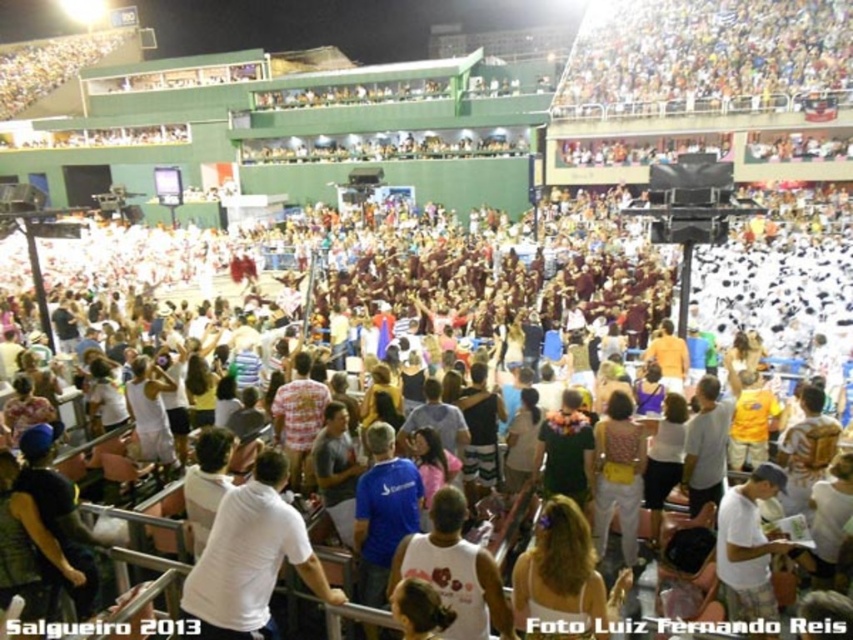
Question: In this image, where is white matte shirt at center located relative to white cotton shirt at center?

Choices:
 (A) left
 (B) right

Answer: (A)

Question: Which point is farther to the camera?

Choices:
 (A) (502, 616)
 (B) (279, 476)

Answer: (B)

Question: Can you confirm if white matte shirt at center is bigger than white cotton shirt at center?

Choices:
 (A) no
 (B) yes

Answer: (B)

Question: Does white matte shirt at center lie behind white cotton shirt at center?

Choices:
 (A) yes
 (B) no

Answer: (A)